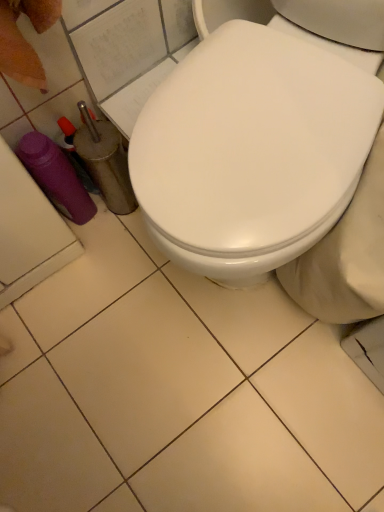
Question: Is white glossy toilet at center to the left or to the right of purple plastic bottle at lower left in the image?

Choices:
 (A) left
 (B) right

Answer: (B)

Question: From the image's perspective, is white glossy toilet at center located above or below purple plastic bottle at lower left?

Choices:
 (A) below
 (B) above

Answer: (B)

Question: Which is nearer to the purple plastic bottle at lower left?

Choices:
 (A) white glossy toilet seat at center
 (B) white glossy toilet at center

Answer: (B)

Question: Based on their relative distances, which object is nearer to the white glossy toilet seat at center?

Choices:
 (A) purple plastic bottle at lower left
 (B) white glossy toilet at center

Answer: (B)